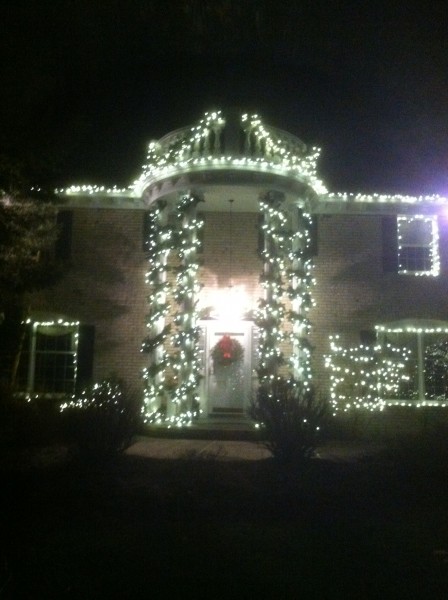
The height and width of the screenshot is (600, 448). In order to click on door in this screenshot , I will do `click(224, 393)`.